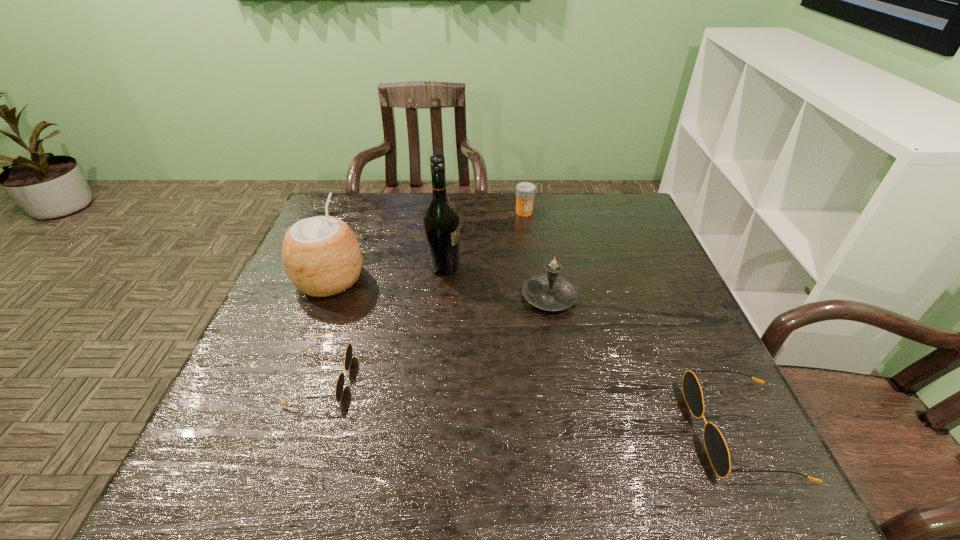
In order to click on coconut at the left edge in this screenshot , I will do `click(321, 254)`.

Find the location of `object at the right edge`. object at the right edge is located at coordinates (717, 450).

At what (x,y) coordinates should I click in order to perform the action: click on object situated at the near left corner. Please return your answer as a coordinate pair (x, y). Image resolution: width=960 pixels, height=540 pixels. Looking at the image, I should click on (340, 382).

Image resolution: width=960 pixels, height=540 pixels. I want to click on object that is at the near right corner, so click(x=717, y=450).

At what (x,y) coordinates should I click in order to perform the action: click on vacant position at the far edge of the desktop. Please return your answer as a coordinate pair (x, y). Image resolution: width=960 pixels, height=540 pixels. Looking at the image, I should click on (484, 204).

Where is `vacant space at the near edge of the desktop`? The width and height of the screenshot is (960, 540). vacant space at the near edge of the desktop is located at coordinates (470, 427).

Identify the location of blank space at the left edge of the desktop. (275, 352).

Identify the location of vacant space at the right edge of the desktop. (612, 254).

The width and height of the screenshot is (960, 540). Identify the location of vacant space at the far left corner. (350, 200).

Find the location of `free space at the near right corner of the desktop`. free space at the near right corner of the desktop is located at coordinates (709, 399).